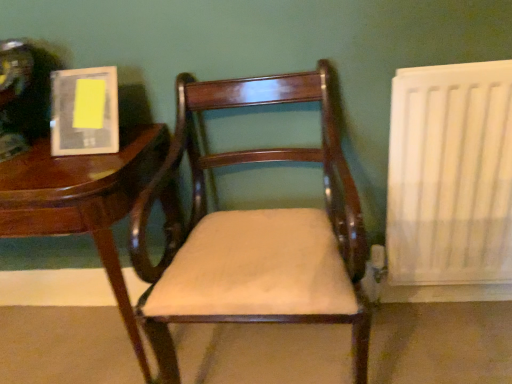
The height and width of the screenshot is (384, 512). What are the coordinates of `vacant area in front of white matte radiator at right` in the screenshot? It's located at (456, 346).